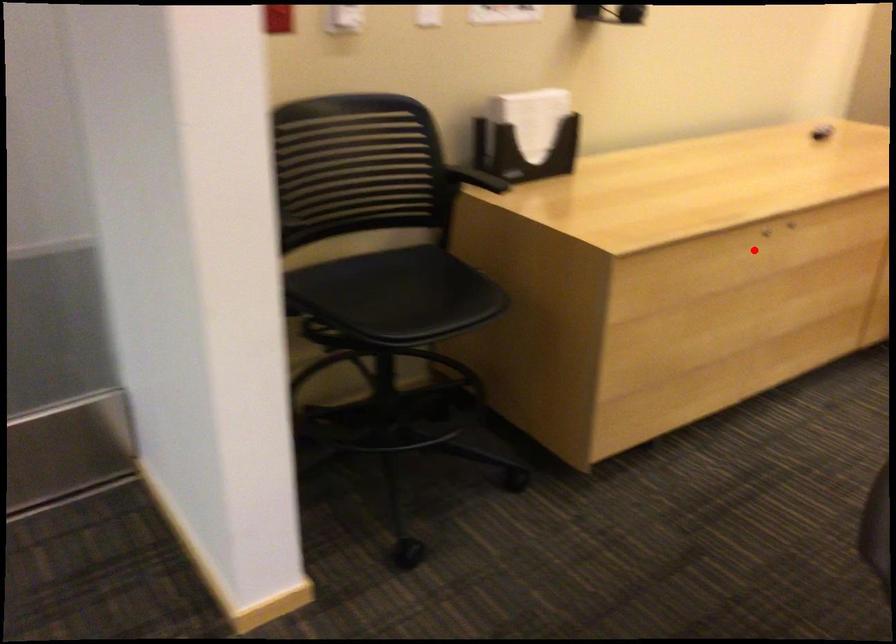
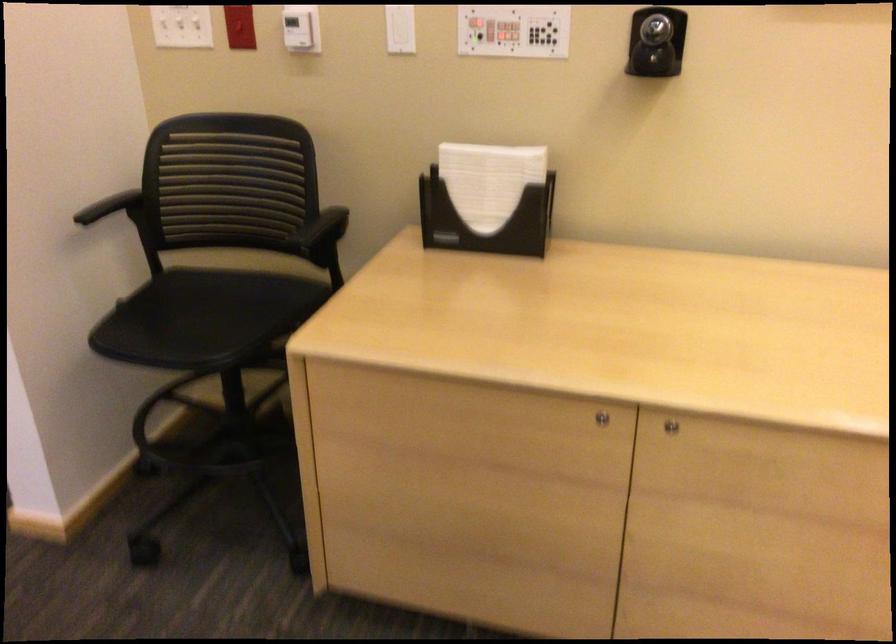
Find the pixel in the second image that matches the highlighted location in the first image.

(600, 418)